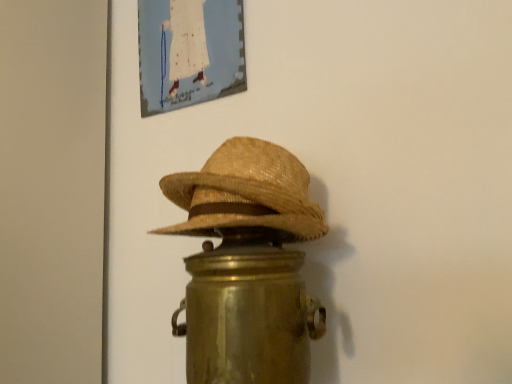
This screenshot has width=512, height=384. Find the location of `matte canvas painting at upper center`. matte canvas painting at upper center is located at coordinates (189, 52).

The image size is (512, 384). What do you see at coordinates (189, 52) in the screenshot? I see `matte canvas painting at upper center` at bounding box center [189, 52].

What is the approximate width of matte canvas painting at upper center?

The width of matte canvas painting at upper center is 1.50 inches.

In order to face woven straw cowboy hat at center, should I rotate leftwards or rightwards?

Turn left by 3.326 degrees to look at woven straw cowboy hat at center.

Describe the element at coordinates (245, 193) in the screenshot. The width and height of the screenshot is (512, 384). I see `woven straw cowboy hat at center` at that location.

The image size is (512, 384). Identify the location of woven straw cowboy hat at center. (245, 193).

What are the coordinates of `matte canvas painting at upper center` in the screenshot? It's located at (189, 52).

Looking at this image, visually, is matte canvas painting at upper center positioned to the left or to the right of woven straw cowboy hat at center?

Based on their positions, matte canvas painting at upper center is located to the left of woven straw cowboy hat at center.

Which object is closer to the camera taking this photo, matte canvas painting at upper center or woven straw cowboy hat at center?

woven straw cowboy hat at center is closer to the camera.

Does point (213, 82) come behind point (249, 162)?

That is True.

From the image's perspective, which is below, matte canvas painting at upper center or woven straw cowboy hat at center?

woven straw cowboy hat at center is shown below in the image.

From a real-world perspective, relative to woven straw cowboy hat at center, is matte canvas painting at upper center vertically above or below?

From a real-world perspective, matte canvas painting at upper center is physically above woven straw cowboy hat at center.

Is matte canvas painting at upper center wider or thinner than woven straw cowboy hat at center?

Considering their sizes, matte canvas painting at upper center looks slimmer than woven straw cowboy hat at center.

Considering the relative sizes of matte canvas painting at upper center and woven straw cowboy hat at center in the image provided, is matte canvas painting at upper center shorter than woven straw cowboy hat at center?

Incorrect, the height of matte canvas painting at upper center does not fall short of that of woven straw cowboy hat at center.

Can you confirm if matte canvas painting at upper center is bigger than woven straw cowboy hat at center?

No.

Is matte canvas painting at upper center not within woven straw cowboy hat at center?

Yes, matte canvas painting at upper center is outside of woven straw cowboy hat at center.

From the picture: Can you see matte canvas painting at upper center touching woven straw cowboy hat at center?

They are not placed beside each other.

Is matte canvas painting at upper center oriented away from woven straw cowboy hat at center?

That's not correct — matte canvas painting at upper center is not looking away from woven straw cowboy hat at center.

How many degrees apart are the facing directions of matte canvas painting at upper center and woven straw cowboy hat at center?

6.51 degrees separate the facing orientations of matte canvas painting at upper center and woven straw cowboy hat at center.

How far apart are matte canvas painting at upper center and woven straw cowboy hat at center?

matte canvas painting at upper center is 15.57 inches away from woven straw cowboy hat at center.

Identify the location of picture frame on the left of the woven straw cowboy hat at center. This screenshot has height=384, width=512. (189, 52).

Considering the positions of objects woven straw cowboy hat at center and matte canvas painting at upper center in the image provided, who is more to the left, woven straw cowboy hat at center or matte canvas painting at upper center?

matte canvas painting at upper center.

Considering the positions of objects woven straw cowboy hat at center and matte canvas painting at upper center in the image provided, who is in front, woven straw cowboy hat at center or matte canvas painting at upper center?

Positioned in front is woven straw cowboy hat at center.

Considering the points (243, 220) and (164, 73), which point is in front, point (243, 220) or point (164, 73)?

The point (243, 220) is in front.

From the image's perspective, which is below, woven straw cowboy hat at center or matte canvas painting at upper center?

From the image's view, woven straw cowboy hat at center is below.

From a real-world perspective, is woven straw cowboy hat at center on matte canvas painting at upper center?

No, from a real-world perspective, woven straw cowboy hat at center is not on top of matte canvas painting at upper center.

Considering the sizes of woven straw cowboy hat at center and matte canvas painting at upper center in the image, is woven straw cowboy hat at center wider or thinner than matte canvas painting at upper center?

woven straw cowboy hat at center is wider than matte canvas painting at upper center.

Between woven straw cowboy hat at center and matte canvas painting at upper center, which one has more height?

matte canvas painting at upper center.

Can you confirm if woven straw cowboy hat at center is bigger than matte canvas painting at upper center?

Correct, woven straw cowboy hat at center is larger in size than matte canvas painting at upper center.

Is woven straw cowboy hat at center spatially inside matte canvas painting at upper center, or outside of it?

woven straw cowboy hat at center lies outside matte canvas painting at upper center.

From the picture: Is woven straw cowboy hat at center positioned far away from matte canvas painting at upper center?

No.

Could you tell me if woven straw cowboy hat at center is facing matte canvas painting at upper center?

No.

The height and width of the screenshot is (384, 512). Identify the location of picture frame above the woven straw cowboy hat at center (from a real-world perspective). (189, 52).

Locate an element on the screen. The image size is (512, 384). picture frame to the left of woven straw cowboy hat at center is located at coordinates (189, 52).

You are a GUI agent. You are given a task and a screenshot of the screen. Output one action in this format:
    pyautogui.click(x=<x>, y=<y>)
    Task: Click on the picture frame that is above the woven straw cowboy hat at center (from a real-world perspective)
    The image size is (512, 384).
    Given the screenshot: What is the action you would take?
    pyautogui.click(x=189, y=52)